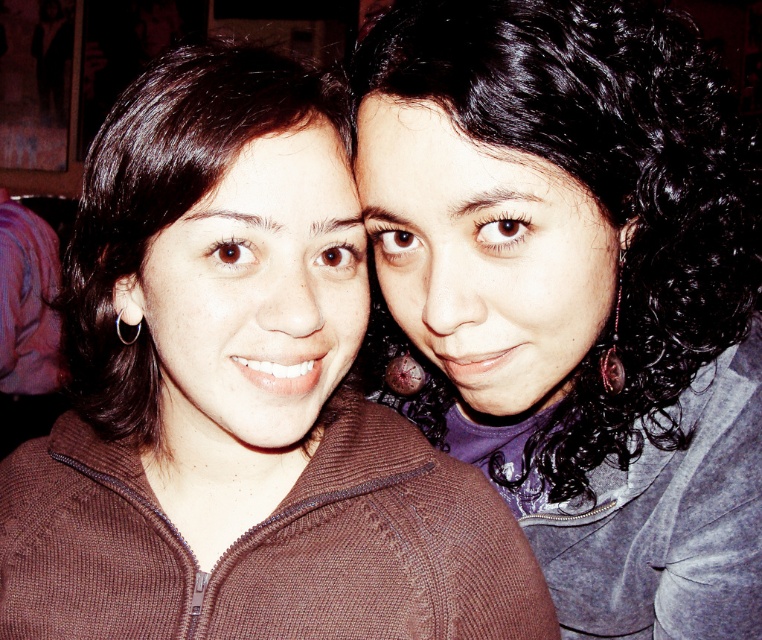
You are a photographer trying to adjust the lighting for a portrait. You notice the brown knitted sweater at center and the brown smooth hair at left. Which object is located lower in the image?

The brown knitted sweater at center is positioned under the brown smooth hair at left, so it is located lower in the image.

You are taking a photo of two people standing side by side. The person on the left has brown smooth hair at left, and the person on the right has black curly hair at upper right. To ensure both hairstyles are visible in the frame, which person should you adjust the camera angle to focus on first?

The black curly hair at upper right is located above the brown smooth hair at left, so you should focus on the person with black curly hair at upper right first to ensure both hairstyles are visible in the frame.